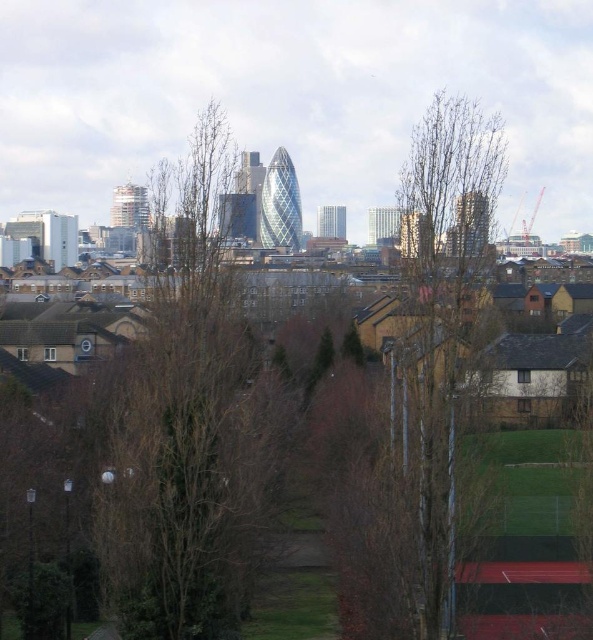
You are standing at the point closest to the camera in the image. Which of the two points, point (x=170, y=492) or point (x=455, y=156), is farther away from you?

Point (x=170, y=492) is behind point (x=455, y=156), so it is farther away from you.

You are a city planner analyzing the park area in the image. You notice two trees in the center of the park. One is labeled as bare branches at center and the other as bare wood tree at center. Which of these two trees has a greater height?

The bare branches at center is taller than the bare wood tree at center according to the description provided.

You are an urban planner analyzing the city park layout. You notice two trees in the central area of the image. The first is labeled as bare branches at center, and the second is labeled as bare wood tree at center. Which of these two trees has a wider spread of branches?

The bare branches at center has a larger width than the bare wood tree at center, so it has a wider spread of branches.